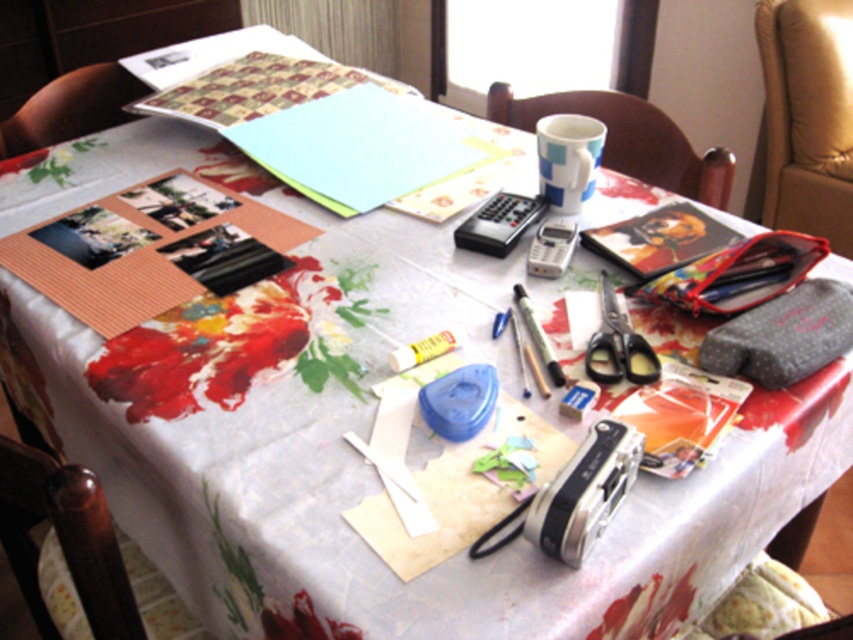
Based on the photo, who is shorter, blue and white ceramic mug at upper center or yellow matte glue stick at center?

yellow matte glue stick at center

Is point (596, 163) positioned in front of point (424, 348)?

No, (596, 163) is behind (424, 348).

Where is `blue and white ceramic mug at upper center`? The image size is (853, 640). blue and white ceramic mug at upper center is located at coordinates (567, 157).

Which is more to the right, wooden chair at upper center or silver metallic phone at center?

wooden chair at upper center is more to the right.

Is wooden chair at upper center shorter than silver metallic phone at center?

No, wooden chair at upper center is not shorter than silver metallic phone at center.

Is point (635, 163) farther from camera compared to point (573, 230)?

Yes, point (635, 163) is behind point (573, 230).

In order to click on wooden chair at upper center in this screenshot , I will do `click(627, 138)`.

Does leather at right have a greater width compared to wooden chair at upper center?

No.

Measure the distance between leather at right and wooden chair at upper center.

leather at right and wooden chair at upper center are 80.20 centimeters apart.

Which is in front, point (817, 212) or point (637, 97)?

Point (637, 97) is more forward.

At what (x,y) coordinates should I click in order to perform the action: click on leather at right. Please return your answer as a coordinate pair (x, y). The height and width of the screenshot is (640, 853). Looking at the image, I should click on (808, 116).